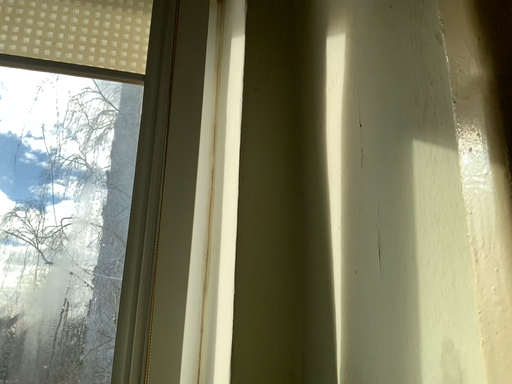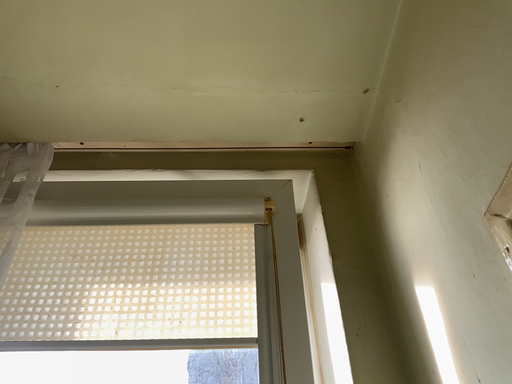
Question: Which way did the camera rotate in the video?

Choices:
 (A) rotated upward
 (B) rotated downward

Answer: (A)